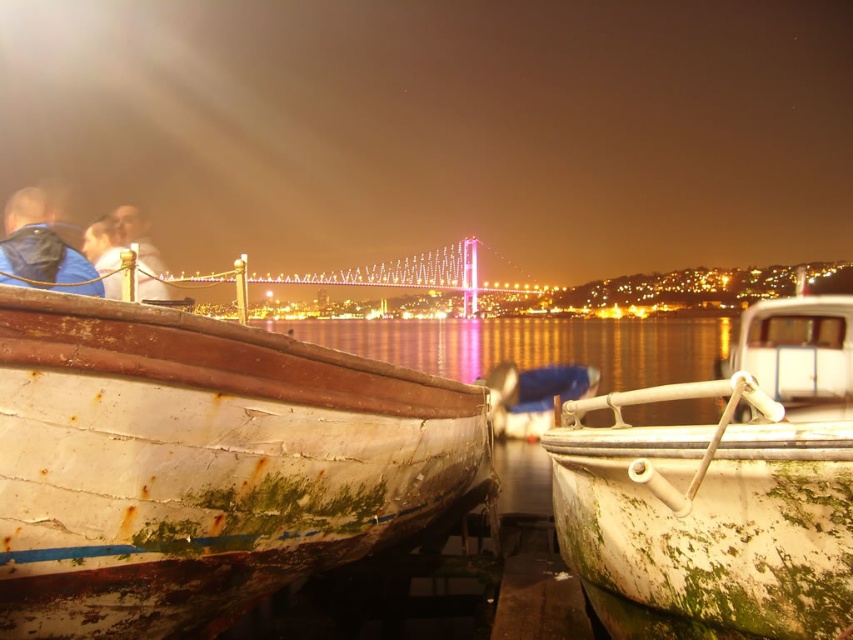
You are a photographer trying to capture both the green mossy wood boat at right and the matte blue jacket at left in the same frame. Given their sizes, which object should you position closer to the camera to ensure both fit within the frame?

Since the green mossy wood boat at right is thinner than the matte blue jacket at left, you should position the green mossy wood boat at right closer to the camera to ensure both fit within the frame.

You are a photographer standing on the dock and see a person wearing a matte blue jacket at left and a matte white shirt at left. Which clothing item is higher on the person?

The matte blue jacket at left is above the matte white shirt at left, so the matte blue jacket at left is higher on the person.

You are standing on the dock and see the green mossy wood boat at right and the matte blue jacket at left. Which object is closer to the left side of the dock?

The matte blue jacket at left is closer to the left side of the dock because the green mossy wood boat at right is positioned on the right side of it.